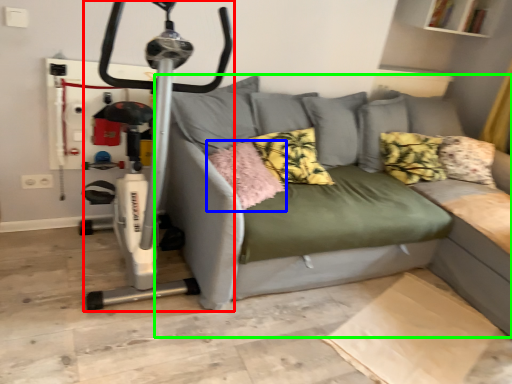
Question: Estimate the real-world distances between objects in this image. Which object is farther from sport equipment (highlighted by a red box), pillow (highlighted by a blue box) or studio couch (highlighted by a green box)?

Choices:
 (A) pillow
 (B) studio couch

Answer: (B)